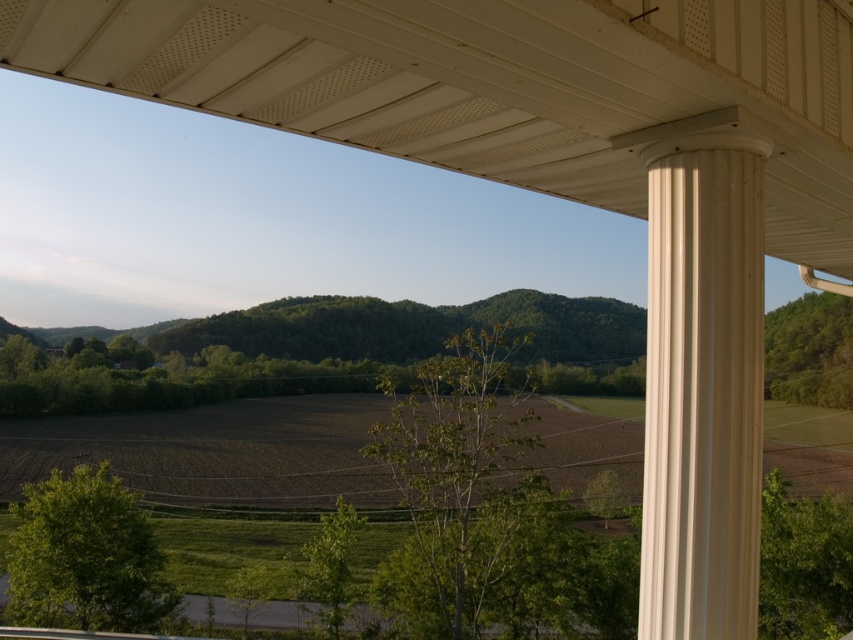
Question: Can you confirm if white textured ceiling at upper center is wider than white smooth column at right?

Choices:
 (A) yes
 (B) no

Answer: (A)

Question: Is white textured ceiling at upper center positioned at the back of white smooth column at right?

Choices:
 (A) yes
 (B) no

Answer: (B)

Question: Which of the following is the closest to the observer?

Choices:
 (A) (679, 132)
 (B) (387, 100)

Answer: (A)

Question: Does white textured ceiling at upper center appear over white smooth column at right?

Choices:
 (A) no
 (B) yes

Answer: (B)